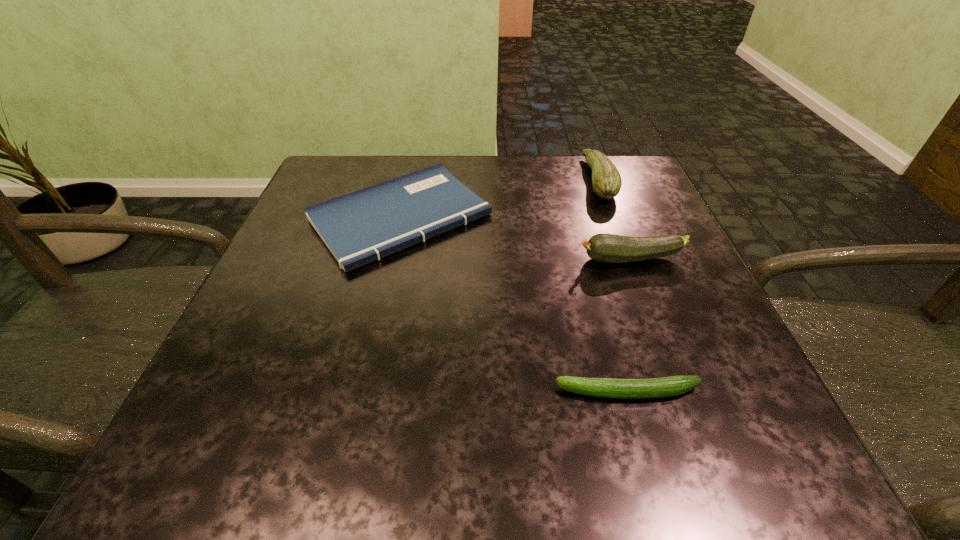
You are a GUI agent. You are given a task and a screenshot of the screen. Output one action in this format:
    pyautogui.click(x=<x>, y=<y>)
    Task: Click on the zucchini identified as the third closest to the paperback book
    
    Given the screenshot: What is the action you would take?
    pyautogui.click(x=673, y=385)

At what (x,y) coordinates should I click in order to perform the action: click on zucchini that is the closest one to the second nearest zucchini. Please return your answer as a coordinate pair (x, y). The image size is (960, 540). Looking at the image, I should click on (606, 180).